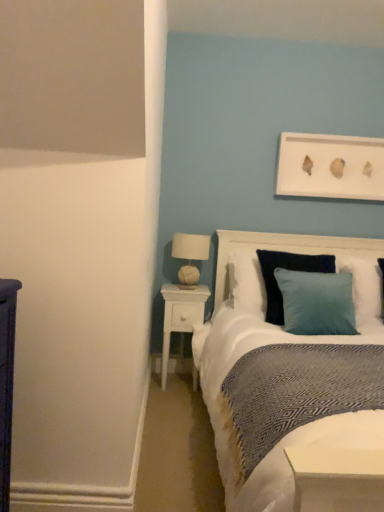
The image size is (384, 512). What are the coordinates of `white fabric-covered lampshade at upper right` in the screenshot? It's located at (190, 255).

Identify the location of white wood nightstand at center. The height and width of the screenshot is (512, 384). (180, 316).

I want to click on table lamp behind the white wood nightstand at center, so click(190, 255).

Which object is closer to the camera, white fabric-covered lampshade at upper right or white wood nightstand at center?

white wood nightstand at center.

Is white fabric-covered lampshade at upper right positioned with its back to white wood nightstand at center?

white fabric-covered lampshade at upper right does not have its back to white wood nightstand at center.

Is white fabric-covered lampshade at upper right to the right of white wood nightstand at center from the viewer's perspective?

Correct, you'll find white fabric-covered lampshade at upper right to the right of white wood nightstand at center.

Based on the photo, does teal velvet pillow at center have a lesser height compared to white wood nightstand at center?

Yes, teal velvet pillow at center is shorter than white wood nightstand at center.

From a real-world perspective, does teal velvet pillow at center sit lower than white wood nightstand at center?

No, from a real-world perspective, teal velvet pillow at center is not beneath white wood nightstand at center.

Considering the positions of point (374, 294) and point (202, 285), is point (374, 294) closer or farther from the camera than point (202, 285)?

Clearly, point (374, 294) is closer to the camera than point (202, 285).

Does teal velvet pillow at center turn towards white wood nightstand at center?

No, teal velvet pillow at center is not oriented towards white wood nightstand at center.

Does white fabric-covered lampshade at upper right lie behind white textured headboard at center?

Yes, white fabric-covered lampshade at upper right is behind white textured headboard at center.

Between white fabric-covered lampshade at upper right and white textured headboard at center, which one has smaller size?

With smaller size is white fabric-covered lampshade at upper right.

Identify the location of table lamp above the white textured headboard at center (from the image's perspective). The image size is (384, 512). (190, 255).

Consider the image. Are white fabric-covered lampshade at upper right and white textured headboard at center making contact?

No, white fabric-covered lampshade at upper right is not in contact with white textured headboard at center.

Which object is thinner, white textured headboard at center or white wood nightstand at center?

white wood nightstand at center is thinner.

Is white textured headboard at center positioned in front of white wood nightstand at center?

Yes, white textured headboard at center is in front of white wood nightstand at center.

Does white textured headboard at center turn towards white wood nightstand at center?

No, white textured headboard at center is not facing towards white wood nightstand at center.

From a real-world perspective, which is physically above, white textured headboard at center or white wood nightstand at center?

In real-world perspective, white textured headboard at center is above.

Considering the sizes of objects white wood nightstand at center and white textured headboard at center in the image provided, who is bigger, white wood nightstand at center or white textured headboard at center?

white textured headboard at center.

Does white wood nightstand at center touch white textured headboard at center?

There is a gap between white wood nightstand at center and white textured headboard at center.

Is white wood nightstand at center positioned with its back to white textured headboard at center?

No, white wood nightstand at center is not facing away from white textured headboard at center.

Is white wood nightstand at center wider than white textured headboard at center?

Incorrect, the width of white wood nightstand at center does not surpass that of white textured headboard at center.

In the image, is white textured headboard at center positioned in front of or behind white fabric-covered lampshade at upper right?

white textured headboard at center is positioned closer to the viewer than white fabric-covered lampshade at upper right.

Is white textured headboard at center not within white fabric-covered lampshade at upper right?

Indeed, white textured headboard at center is completely outside white fabric-covered lampshade at upper right.

In the scene shown: Considering the positions of objects white textured headboard at center and white fabric-covered lampshade at upper right in the image provided, who is more to the left, white textured headboard at center or white fabric-covered lampshade at upper right?

white fabric-covered lampshade at upper right is more to the left.

Considering the positions of point (256, 241) and point (183, 266), is point (256, 241) closer or farther from the camera than point (183, 266)?

Point (256, 241) is closer to the camera than point (183, 266).

Which object is closer to the camera, teal velvet pillow at center or white fabric-covered lampshade at upper right?

teal velvet pillow at center is closer to the camera.

Which object is positioned more to the left, teal velvet pillow at center or white fabric-covered lampshade at upper right?

white fabric-covered lampshade at upper right is more to the left.

Choose the correct answer: Is teal velvet pillow at center inside white fabric-covered lampshade at upper right or outside it?

teal velvet pillow at center is outside white fabric-covered lampshade at upper right.

In order to click on table lamp behind the white wood nightstand at center in this screenshot , I will do `click(190, 255)`.

Locate an element on the screen. This screenshot has height=512, width=384. pillow that is on the right side of white wood nightstand at center is located at coordinates (365, 293).

Which object lies further to the anchor point teal velvet pillow at center, white textured headboard at center or white fabric-covered lampshade at upper right?

Among the two, white fabric-covered lampshade at upper right is located further to teal velvet pillow at center.

When comparing their distances from white wood nightstand at center, does white textured headboard at center or teal velvet pillow at center seem further?

teal velvet pillow at center.

From the picture: When comparing their distances from teal velvet pillow at center, does white textured headboard at center or white wood nightstand at center seem further?

Among the two, white wood nightstand at center is located further to teal velvet pillow at center.

Estimate the real-world distances between objects in this image. Which object is closer to white wood nightstand at center, white textured headboard at center or white fabric-covered lampshade at upper right?

white fabric-covered lampshade at upper right.

Considering their positions, is white textured headboard at center positioned closer to white fabric-covered lampshade at upper right than teal velvet pillow at center?

white textured headboard at center.

Based on their spatial positions, is white wood nightstand at center or white fabric-covered lampshade at upper right further from teal velvet pillow at center?

white wood nightstand at center is positioned further to the anchor teal velvet pillow at center.

Looking at this image, which object lies further to the anchor point teal velvet pillow at center, white fabric-covered lampshade at upper right or white wood nightstand at center?

white wood nightstand at center lies further to teal velvet pillow at center than the other object.

Looking at the image, which one is located further to white wood nightstand at center, white fabric-covered lampshade at upper right or white textured headboard at center?

white textured headboard at center lies further to white wood nightstand at center than the other object.

Find the location of `table lamp between white wood nightstand at center and white textured headboard at center`. table lamp between white wood nightstand at center and white textured headboard at center is located at coordinates (190, 255).

Where is `table lamp situated between white wood nightstand at center and teal velvet pillow at center from left to right`? The image size is (384, 512). table lamp situated between white wood nightstand at center and teal velvet pillow at center from left to right is located at coordinates [190, 255].

The width and height of the screenshot is (384, 512). Find the location of `headboard between white wood nightstand at center and teal velvet pillow at center from left to right`. headboard between white wood nightstand at center and teal velvet pillow at center from left to right is located at coordinates (287, 250).

This screenshot has width=384, height=512. I want to click on headboard between white fabric-covered lampshade at upper right and teal velvet pillow at center from left to right, so click(287, 250).